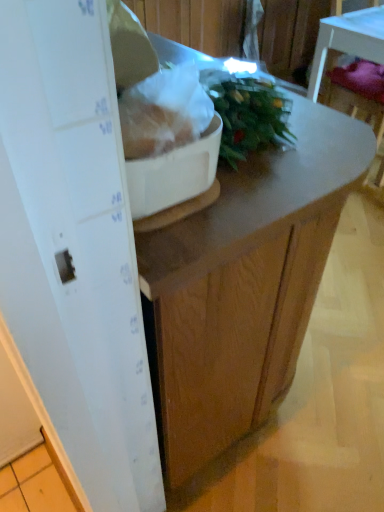
This screenshot has height=512, width=384. Describe the element at coordinates (243, 287) in the screenshot. I see `wooden desk at center` at that location.

Image resolution: width=384 pixels, height=512 pixels. What are the coordinates of `wooden desk at center` in the screenshot? It's located at (243, 287).

At what (x,y) coordinates should I click in order to perform the action: click on wooden desk at center. Please return your answer as a coordinate pair (x, y). The height and width of the screenshot is (512, 384). Looking at the image, I should click on (243, 287).